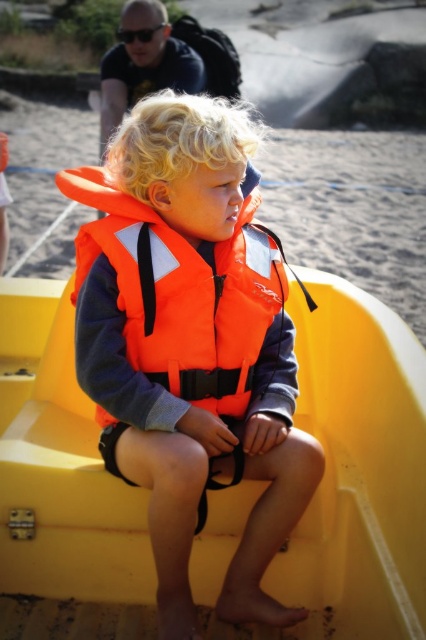
Question: Which point is closer to the camera taking this photo?

Choices:
 (A) (241, 468)
 (B) (235, 284)

Answer: (A)

Question: Does orange fabric life vest at center appear on the left side of orange fabric life jacket at center?

Choices:
 (A) no
 (B) yes

Answer: (A)

Question: Is orange fabric life vest at center positioned behind orange fabric life jacket at center?

Choices:
 (A) no
 (B) yes

Answer: (A)

Question: Which of the following is the closest to the observer?

Choices:
 (A) orange fabric life vest at center
 (B) orange fabric life jacket at center

Answer: (A)

Question: In this image, where is orange fabric life vest at center located relative to orange fabric life jacket at center?

Choices:
 (A) above
 (B) below

Answer: (B)

Question: Which of the following is the farthest from the observer?

Choices:
 (A) (236, 371)
 (B) (250, 518)

Answer: (A)